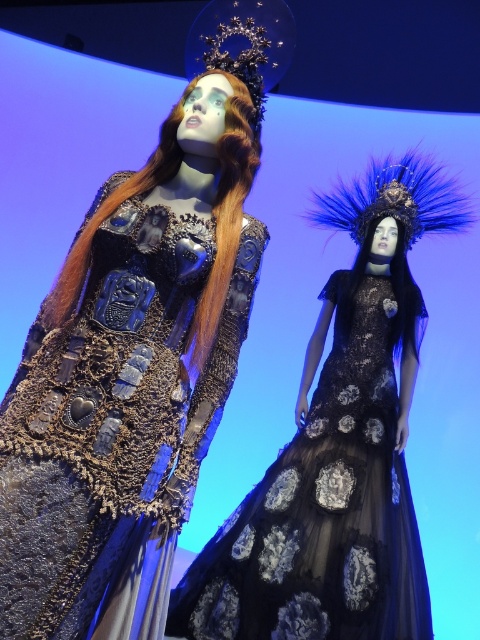
Who is more distant from viewer, (87, 515) or (385, 364)?

The point (385, 364) is behind.

Does shiny metallic dress at center have a smaller size compared to black tulle dress at center?

Indeed, shiny metallic dress at center has a smaller size compared to black tulle dress at center.

Who is more distant from viewer, (105, 316) or (310, 435)?

The point (310, 435) is more distant.

Locate an element on the screen. shiny metallic dress at center is located at coordinates (116, 428).